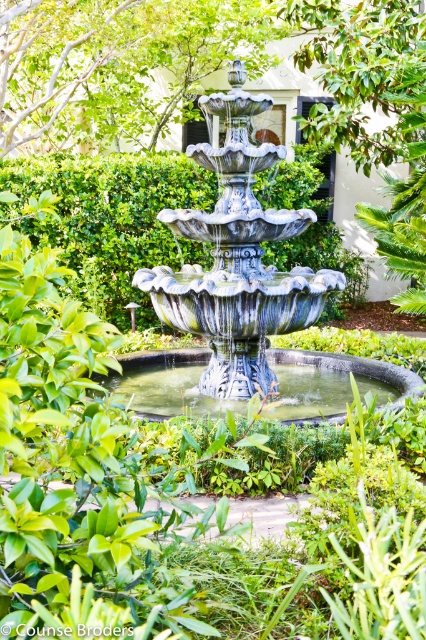
You are standing in the garden and want to locate the exact spot where a hidden treasure is buried. The treasure map says it is buried at point coordinates point (233,266). According to the scene description, where is this point located?

The point (233,266) is on the stone fountain at center.

You are a gardener who needs to prune the green leafy hedge at center and the metallic fountain at center. Which object requires taller pruning shears due to its height?

The green leafy hedge at center is much taller than the metallic fountain at center, so it requires taller pruning shears to reach its height.